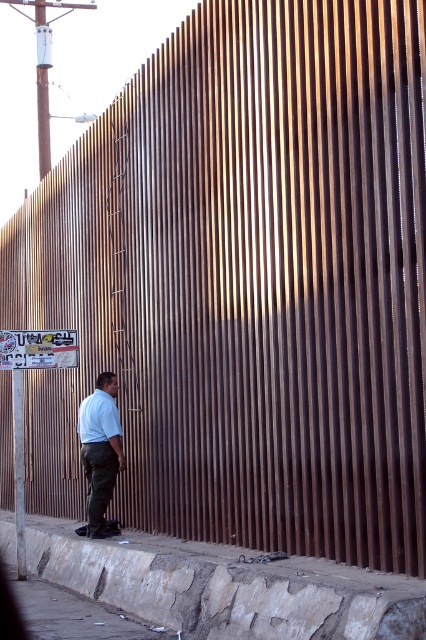
Where is the light blue shirt at center located in the image?

The light blue shirt at center is located at point coordinates of approximately 0.703 on the x axis and 0.235 on the y axis.